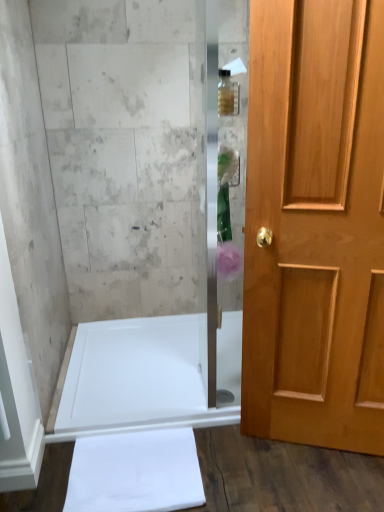
Find the location of `light brown wooden door at right`. light brown wooden door at right is located at coordinates (315, 225).

The width and height of the screenshot is (384, 512). Describe the element at coordinates (315, 225) in the screenshot. I see `light brown wooden door at right` at that location.

This screenshot has width=384, height=512. I want to click on translucent glass bottle at upper center, so click(226, 94).

Considering the relative sizes of translucent glass bottle at upper center and light brown wooden door at right in the image provided, is translucent glass bottle at upper center taller than light brown wooden door at right?

No.

From the image's perspective, is translucent glass bottle at upper center located above or below light brown wooden door at right?

Clearly, from the image's perspective, translucent glass bottle at upper center is above light brown wooden door at right.

From a real-world perspective, which is physically above, translucent glass bottle at upper center or light brown wooden door at right?

In real-world perspective, translucent glass bottle at upper center is above.

Which object is positioned more to the left, translucent glass bottle at upper center or white glossy bathtub at lower left?

Positioned to the left is white glossy bathtub at lower left.

Is translucent glass bottle at upper center located outside white glossy bathtub at lower left?

Yes.

Between translucent glass bottle at upper center and white glossy bathtub at lower left, which one is positioned behind?

white glossy bathtub at lower left is behind.

From the image's perspective, does translucent glass bottle at upper center appear higher than white glossy bathtub at lower left?

Yes.

From the picture: Can you tell me how much light brown wooden door at right and translucent glass bottle at upper center differ in facing direction?

17.3 degrees.

Considering the relative sizes of light brown wooden door at right and translucent glass bottle at upper center in the image provided, is light brown wooden door at right shorter than translucent glass bottle at upper center?

Incorrect, the height of light brown wooden door at right does not fall short of that of translucent glass bottle at upper center.

Can you confirm if light brown wooden door at right is positioned to the left of translucent glass bottle at upper center?

No.

Is there a large distance between white glossy bathtub at lower left and translucent glass bottle at upper center?

white glossy bathtub at lower left is far away from translucent glass bottle at upper center.

Consider the image. Is white glossy bathtub at lower left bigger than translucent glass bottle at upper center?

Indeed, white glossy bathtub at lower left has a larger size compared to translucent glass bottle at upper center.

Choose the correct answer: Is white glossy bathtub at lower left inside translucent glass bottle at upper center or outside it?

white glossy bathtub at lower left is spatially situated outside translucent glass bottle at upper center.

From a real-world perspective, does white glossy bathtub at lower left sit lower than translucent glass bottle at upper center?

Correct, in the physical world, white glossy bathtub at lower left is lower than translucent glass bottle at upper center.

Locate an element on the screen. Image resolution: width=384 pixels, height=512 pixels. flower below the light brown wooden door at right (from the image's perspective) is located at coordinates (228, 261).

From the image's perspective, which is below, translucent pink flower at center or light brown wooden door at right?

translucent pink flower at center is shown below in the image.

From the picture: Considering the sizes of translucent pink flower at center and light brown wooden door at right in the image, is translucent pink flower at center bigger or smaller than light brown wooden door at right?

In the image, translucent pink flower at center appears to be smaller than light brown wooden door at right.

Is translucent pink flower at center not near light brown wooden door at right?

No, translucent pink flower at center is not far away from light brown wooden door at right.

Is light brown wooden door at right oriented towards white glossy bathtub at lower left?

No, light brown wooden door at right is not oriented towards white glossy bathtub at lower left.

Is light brown wooden door at right to the left or to the right of white glossy bathtub at lower left in the image?

In the image, light brown wooden door at right appears on the right side of white glossy bathtub at lower left.

Does light brown wooden door at right have a greater height compared to white glossy bathtub at lower left?

Yes, light brown wooden door at right is taller than white glossy bathtub at lower left.

Does light brown wooden door at right have a smaller size compared to translucent pink flower at center?

No, light brown wooden door at right is not smaller than translucent pink flower at center.

From a real-world perspective, is light brown wooden door at right physically below translucent pink flower at center?

Incorrect, from a real-world perspective, light brown wooden door at right is higher than translucent pink flower at center.

Relative to translucent pink flower at center, is light brown wooden door at right in front or behind?

In the image, light brown wooden door at right appears in front of translucent pink flower at center.

This screenshot has width=384, height=512. Find the location of `door located above the translucent pink flower at center (from a real-world perspective)`. door located above the translucent pink flower at center (from a real-world perspective) is located at coordinates (315, 225).

Identify the location of door to the right of translucent glass bottle at upper center. This screenshot has width=384, height=512. [x=315, y=225].

Find the location of a particular element. bath located on the left of translucent glass bottle at upper center is located at coordinates (147, 376).

When comparing their distances from translucent glass bottle at upper center, does white glossy bathtub at lower left or translucent pink flower at center seem closer?

translucent pink flower at center lies closer to translucent glass bottle at upper center than the other object.

Which object lies further to the anchor point white glossy bathtub at lower left, translucent pink flower at center or light brown wooden door at right?

Among the two, translucent pink flower at center is located further to white glossy bathtub at lower left.

When comparing their distances from translucent pink flower at center, does translucent glass bottle at upper center or white glossy bathtub at lower left seem further?

The object further to translucent pink flower at center is white glossy bathtub at lower left.

When comparing their distances from light brown wooden door at right, does white glossy bathtub at lower left or translucent glass bottle at upper center seem closer?

Among the two, translucent glass bottle at upper center is located nearer to light brown wooden door at right.

Estimate the real-world distances between objects in this image. Which object is further from light brown wooden door at right, translucent pink flower at center or translucent glass bottle at upper center?

translucent glass bottle at upper center is further to light brown wooden door at right.

From the image, which object appears to be farther from translucent pink flower at center, translucent glass bottle at upper center or light brown wooden door at right?

translucent glass bottle at upper center lies further to translucent pink flower at center than the other object.

When comparing their distances from translucent glass bottle at upper center, does white glossy bathtub at lower left or light brown wooden door at right seem closer?

light brown wooden door at right is closer to translucent glass bottle at upper center.

Considering their positions, is light brown wooden door at right positioned closer to translucent glass bottle at upper center than translucent pink flower at center?

Based on the image, translucent pink flower at center appears to be nearer to translucent glass bottle at upper center.

Identify the location of flower between translucent glass bottle at upper center and white glossy bathtub at lower left from top to bottom. The width and height of the screenshot is (384, 512). (228, 261).

At what (x,y) coordinates should I click in order to perform the action: click on door between translucent glass bottle at upper center and translucent pink flower at center in the up-down direction. Please return your answer as a coordinate pair (x, y). This screenshot has width=384, height=512. Looking at the image, I should click on (315, 225).

Image resolution: width=384 pixels, height=512 pixels. I want to click on door between translucent glass bottle at upper center and white glossy bathtub at lower left in the up-down direction, so click(315, 225).

The height and width of the screenshot is (512, 384). Find the location of `flower between light brown wooden door at right and white glossy bathtub at lower left in the front-back direction`. flower between light brown wooden door at right and white glossy bathtub at lower left in the front-back direction is located at coordinates (228, 261).